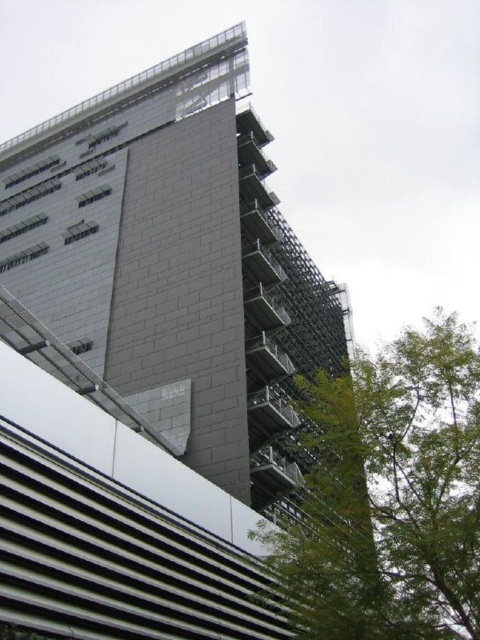
Does gray concrete building at upper center have a lesser height compared to green leafy tree at lower right?

Incorrect, gray concrete building at upper center's height does not fall short of green leafy tree at lower right's.

Does gray concrete building at upper center have a greater height compared to green leafy tree at lower right?

Yes, gray concrete building at upper center is taller than green leafy tree at lower right.

Identify the location of gray concrete building at upper center. The image size is (480, 640). (172, 266).